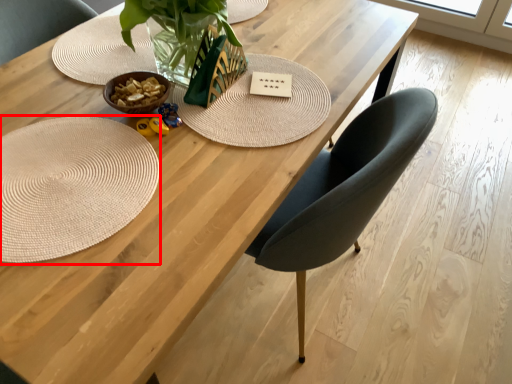
Question: From the image's perspective, where is mat (annotated by the red box) located relative to card?

Choices:
 (A) below
 (B) above

Answer: (A)